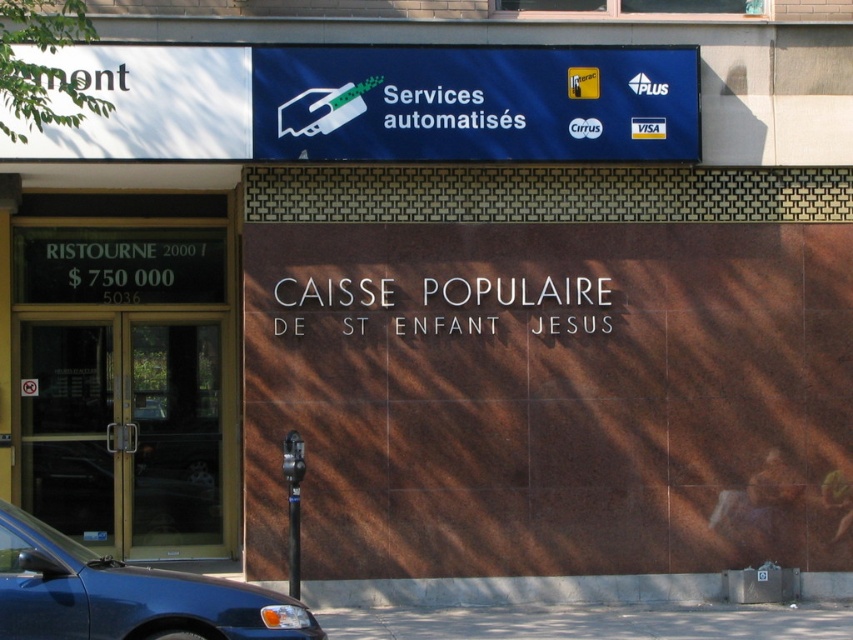
Question: Is blue fabric sign at upper center below metallic parking sign at lower center?

Choices:
 (A) no
 (B) yes

Answer: (A)

Question: Does gold metallic door at left appear on the left side of metallic parking sign at lower center?

Choices:
 (A) no
 (B) yes

Answer: (B)

Question: Which of these objects is positioned closest to the gold metallic door at left?

Choices:
 (A) metallic blue car at lower left
 (B) metallic parking sign at lower center
 (C) blue fabric sign at upper center

Answer: (B)

Question: Which point is closer to the camera taking this photo?

Choices:
 (A) (21, 380)
 (B) (297, 474)
 (C) (277, 627)

Answer: (C)

Question: Which of the following is the closest to the observer?

Choices:
 (A) gold metallic door at left
 (B) blue fabric sign at upper center
 (C) metallic parking sign at lower center

Answer: (C)

Question: Can you confirm if blue fabric sign at upper center is wider than metallic blue car at lower left?

Choices:
 (A) yes
 (B) no

Answer: (A)